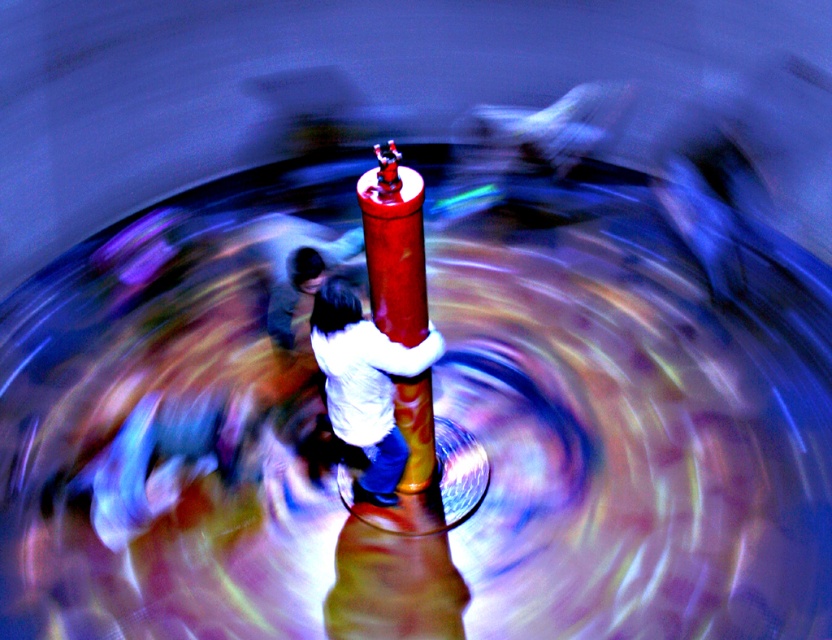
Does white matte shirt at center have a smaller size compared to shiny red pole at center?

No, white matte shirt at center is not smaller than shiny red pole at center.

Does white matte shirt at center appear on the left side of shiny red pole at center?

Correct, you'll find white matte shirt at center to the left of shiny red pole at center.

The height and width of the screenshot is (640, 832). Find the location of `white matte shirt at center`. white matte shirt at center is located at coordinates (365, 384).

This screenshot has height=640, width=832. In order to click on white matte shirt at center in this screenshot , I will do `click(365, 384)`.